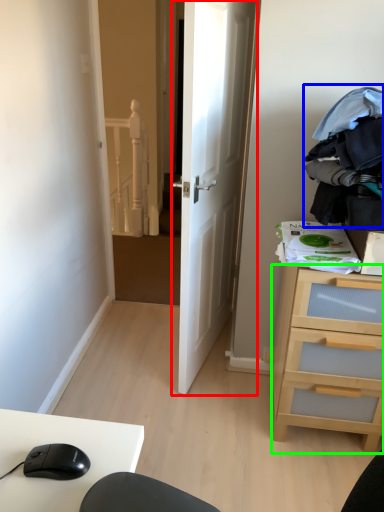
Question: Based on their relative distances, which object is farther from door (highlighted by a red box)? Choose from clothing (highlighted by a blue box) and chest of drawers (highlighted by a green box).

Choices:
 (A) clothing
 (B) chest of drawers

Answer: (B)